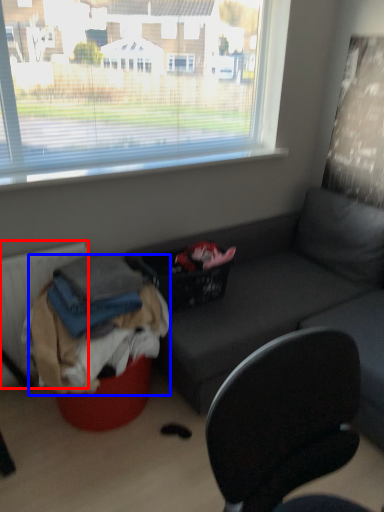
Question: Which object is closer to the camera taking this photo, radiator (highlighted by a red box) or clothing (highlighted by a blue box)?

Choices:
 (A) radiator
 (B) clothing

Answer: (B)